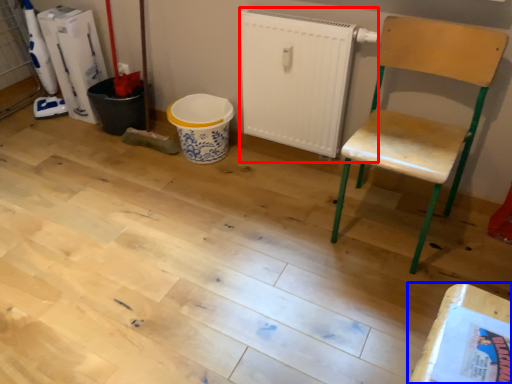
Question: Which object is closer to the camera taking this photo, radiator (highlighted by a red box) or table (highlighted by a blue box)?

Choices:
 (A) radiator
 (B) table

Answer: (B)